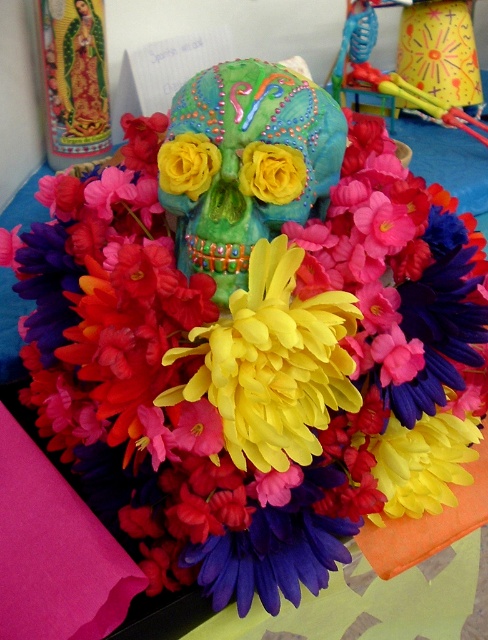
Which of these two, yellow paper flower at center or metallic blue toy at upper right, stands shorter?

With less height is yellow paper flower at center.

Is yellow paper flower at center to the right of metallic blue toy at upper right from the viewer's perspective?

No, yellow paper flower at center is not to the right of metallic blue toy at upper right.

This screenshot has width=488, height=640. In order to click on yellow paper flower at center in this screenshot , I will do `click(272, 364)`.

The width and height of the screenshot is (488, 640). In order to click on yellow paper flower at center in this screenshot , I will do `click(272, 364)`.

Does matte painted skull at center have a greater width compared to metallic blue toy at upper right?

Incorrect, matte painted skull at center's width does not surpass metallic blue toy at upper right's.

Identify the location of matte painted skull at center. The width and height of the screenshot is (488, 640). (244, 163).

Who is more forward, (189,148) or (342,52)?

Positioned in front is point (189,148).

I want to click on matte painted skull at center, so click(244, 163).

Can you confirm if matte painted skull at center is positioned above yellow paper flower at center?

Indeed, matte painted skull at center is positioned over yellow paper flower at center.

Who is higher up, matte painted skull at center or yellow paper flower at center?

matte painted skull at center is higher up.

Who is more forward, (272, 176) or (228, 406)?

Positioned in front is point (228, 406).

Where is `matte painted skull at center`? Image resolution: width=488 pixels, height=640 pixels. matte painted skull at center is located at coordinates (244, 163).